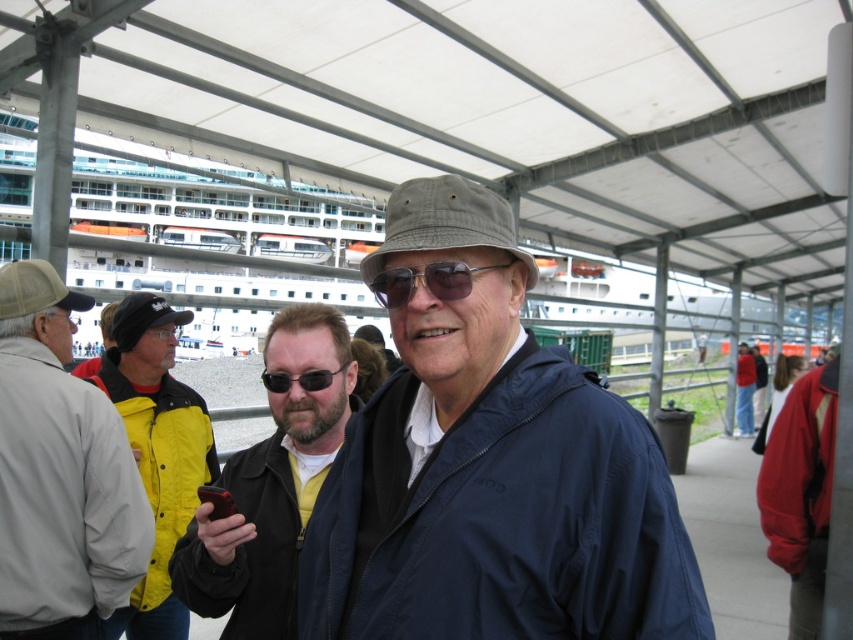
Based on the photo, can you confirm if yellow jacket at center is positioned to the right of black matte goggles at upper left?

Incorrect, yellow jacket at center is not on the right side of black matte goggles at upper left.

Consider the image. Can you confirm if yellow jacket at center is thinner than black matte goggles at upper left?

Incorrect, yellow jacket at center's width is not less than black matte goggles at upper left's.

Is point (122, 394) positioned before point (161, 337)?

Yes, it is in front of point (161, 337).

This screenshot has width=853, height=640. I want to click on yellow jacket at center, so click(155, 452).

Can you confirm if white metal cruise ship at upper center is taller than red jacket at center?

Yes.

Does white metal cruise ship at upper center have a larger size compared to red jacket at center?

Yes, white metal cruise ship at upper center is bigger than red jacket at center.

Which is behind, point (90, 195) or point (740, 372)?

The point (90, 195) is behind.

Where is `white metal cruise ship at upper center`? white metal cruise ship at upper center is located at coordinates click(215, 220).

Can you confirm if matte black jacket at center is wider than tan mesh cap at left?

No, matte black jacket at center is not wider than tan mesh cap at left.

Who is lower down, matte black jacket at center or tan mesh cap at left?

matte black jacket at center is lower down.

Which is in front, point (252, 506) or point (57, 296)?

Point (252, 506) is more forward.

This screenshot has width=853, height=640. Find the location of `matte black jacket at center`. matte black jacket at center is located at coordinates (271, 486).